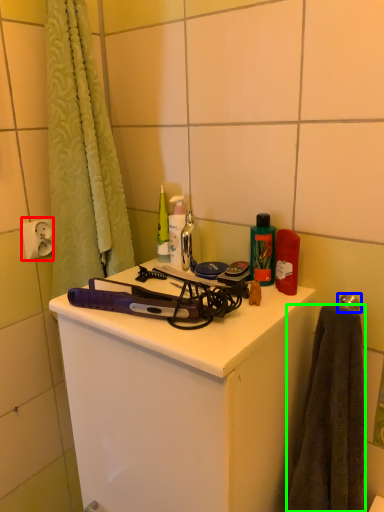
Question: Based on their relative distances, which object is nearer to electric outlet (highlighted by a red box)? Choose from towel bar (highlighted by a blue box) and towel/napkin (highlighted by a green box).

Choices:
 (A) towel bar
 (B) towel/napkin

Answer: (A)